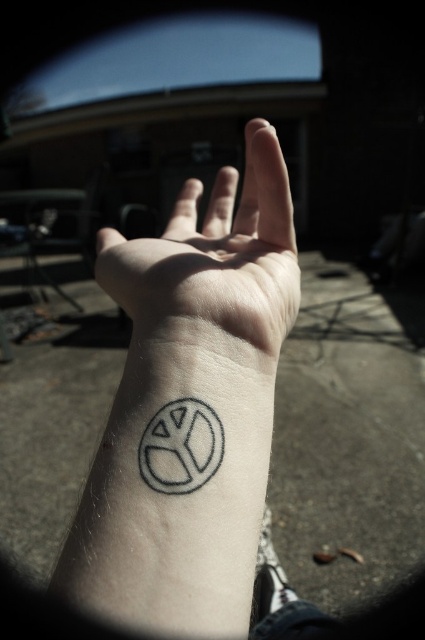
You are a tattoo artist reviewing a client photo. The client wants to add a small star tattoo near the existing black ink tattoo at lower left. The star must be placed within a 1 cm radius of the existing tattoo. Based on the coordinates given, can the star be placed without overlapping the existing tattoo?

The black ink tattoo at lower left is located at point (189, 408). Since the star must be placed within a 1 cm radius of this point, it can be positioned nearby without overlapping the existing tattoo as long as it stays within that 1 cm range.

You are a tattoo artist assessing a client who wants to add a new tattoo to their wrist. The existing tattoo is the black ink tattoo at lower left, and the client wants the new tattoo to be placed on the pale skin at center. Based on the spacing between them, can you confirm if there is enough room for the new tattoo without overlapping the existing one?

The black ink tattoo at lower left and the pale skin at center are 0.92 inches apart. Since the distance between them is sufficient, the new tattoo can be placed on the pale skin at center without overlapping the existing black ink tattoo at lower left.

You are a tattoo artist assessing the placement of a new tattoo. The client wants to ensure there is enough space between the pale skin at center and the gray ink peace sign at lower center. Given that the minimum required distance for proper healing is 1 inch, can the current placement accommodate this requirement?

The pale skin at center is 6.97 inches from the gray ink peace sign at lower center, which exceeds the minimum required distance of 1 inch for proper healing. The current placement can accommodate the requirement.